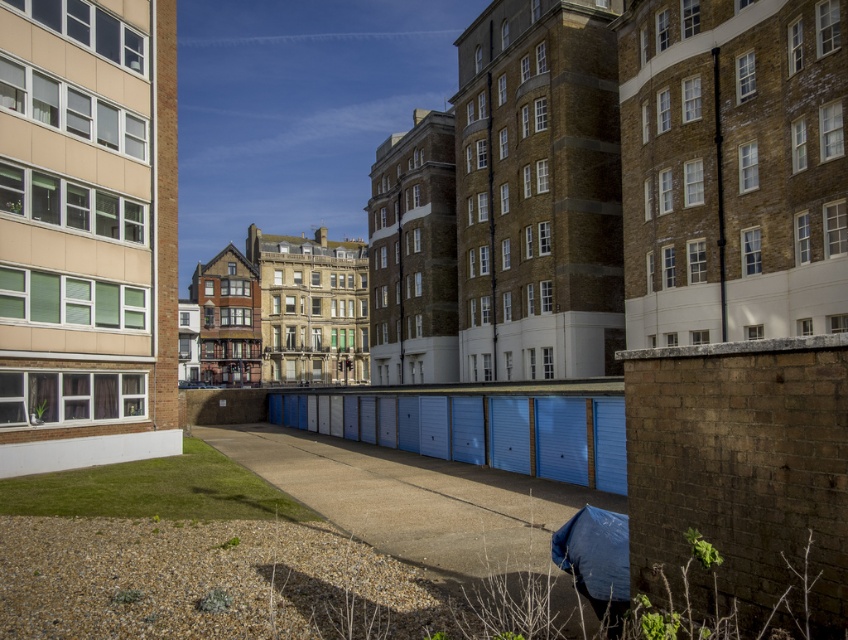
Question: Does smooth concrete pavement at center appear under blue fabric umbrella at lower right?

Choices:
 (A) no
 (B) yes

Answer: (B)

Question: Is smooth concrete pavement at center thinner than blue fabric umbrella at lower right?

Choices:
 (A) yes
 (B) no

Answer: (B)

Question: From the image, what is the correct spatial relationship of smooth concrete pavement at center in relation to blue fabric umbrella at lower right?

Choices:
 (A) right
 (B) left

Answer: (B)

Question: Which of the following is the closest to the observer?

Choices:
 (A) (611, 538)
 (B) (449, 515)

Answer: (A)

Question: Which point appears closest to the camera in this image?

Choices:
 (A) click(x=483, y=548)
 (B) click(x=577, y=552)

Answer: (B)